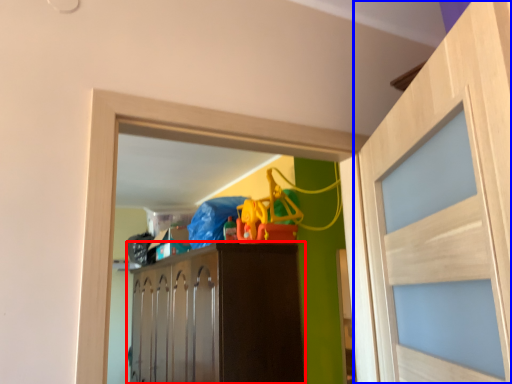
Question: Which of the following is the farthest to the observer, cabinetry (highlighted by a red box) or door (highlighted by a blue box)?

Choices:
 (A) cabinetry
 (B) door

Answer: (A)